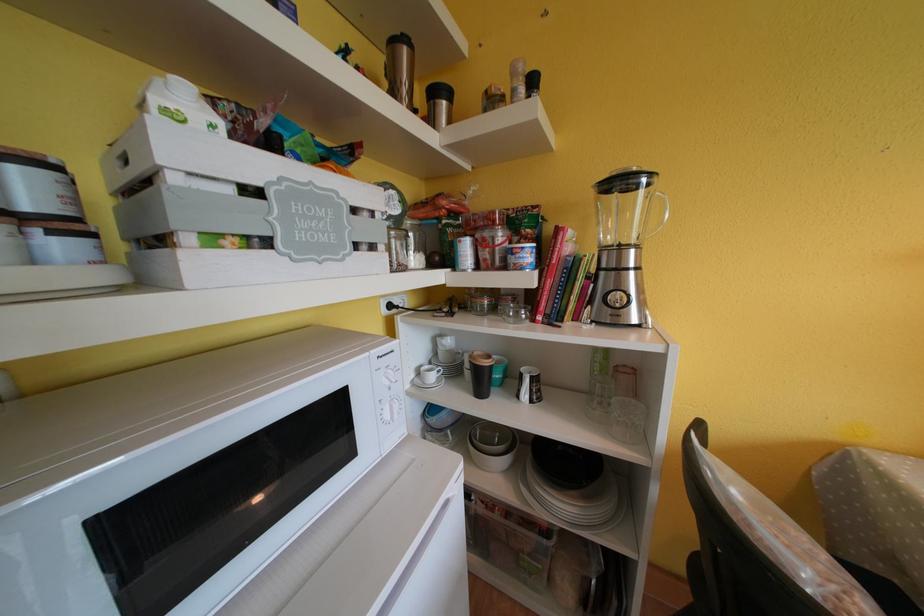
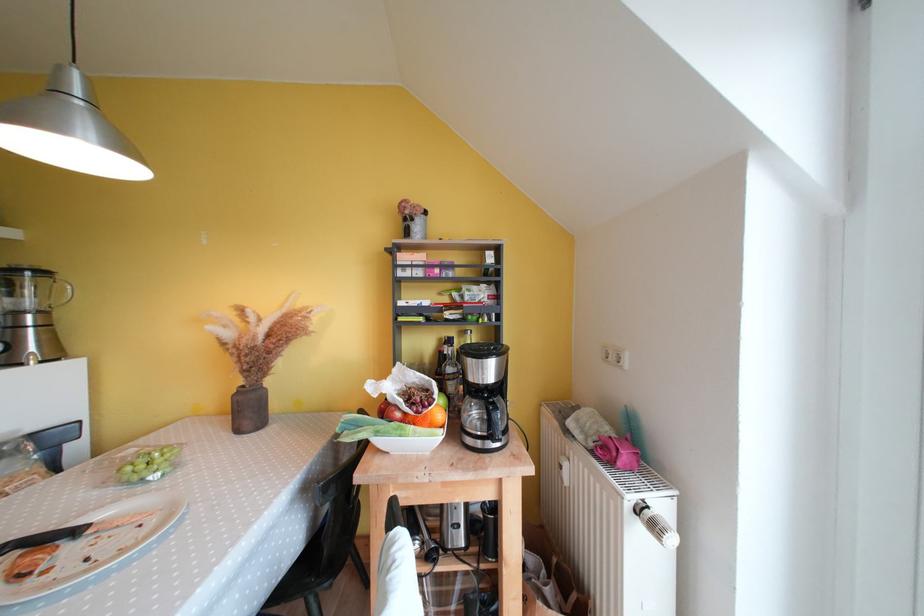
Where in the second image is the point corresponding to pixel 641 251 from the first image?

(49, 315)